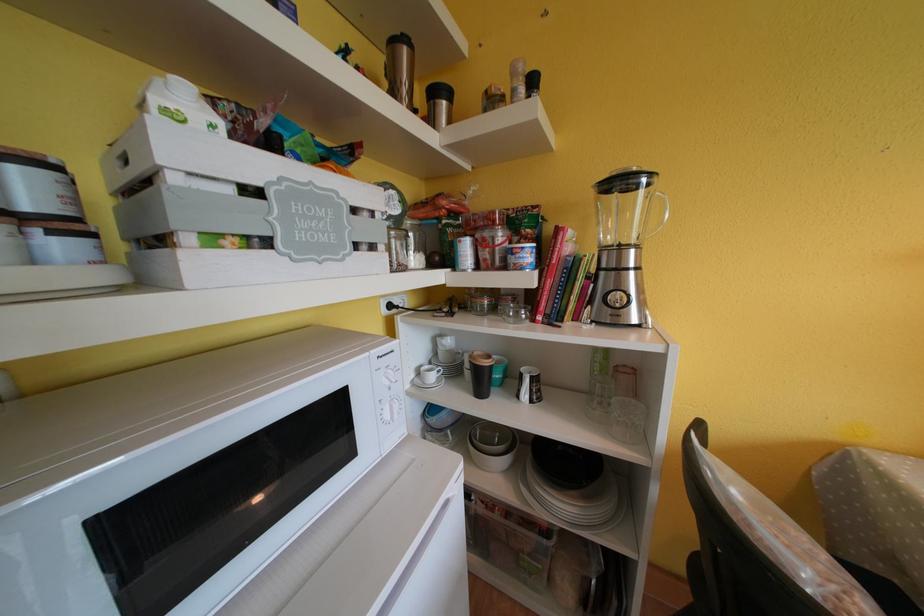
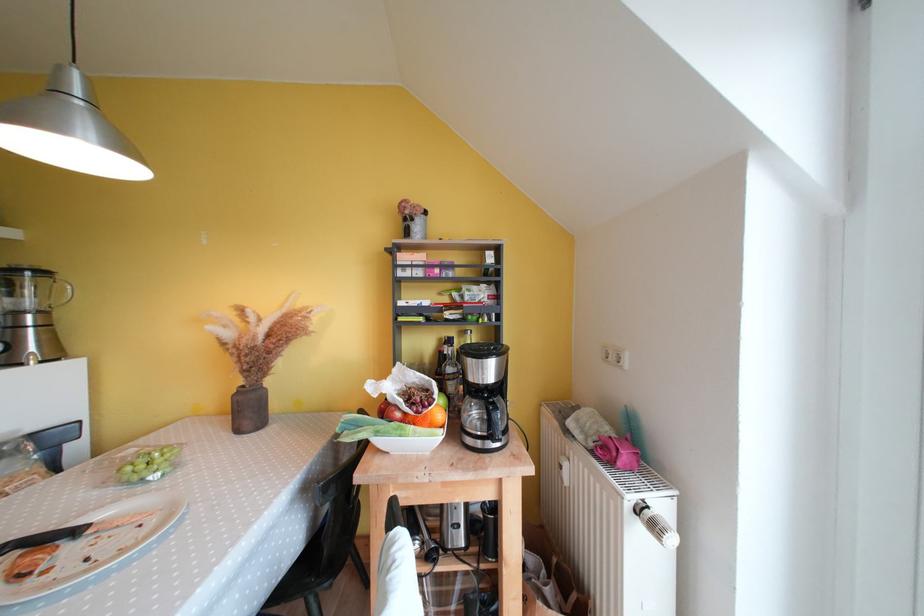
Where in the second image is the point corresponding to pixel 641 251 from the first image?

(49, 315)